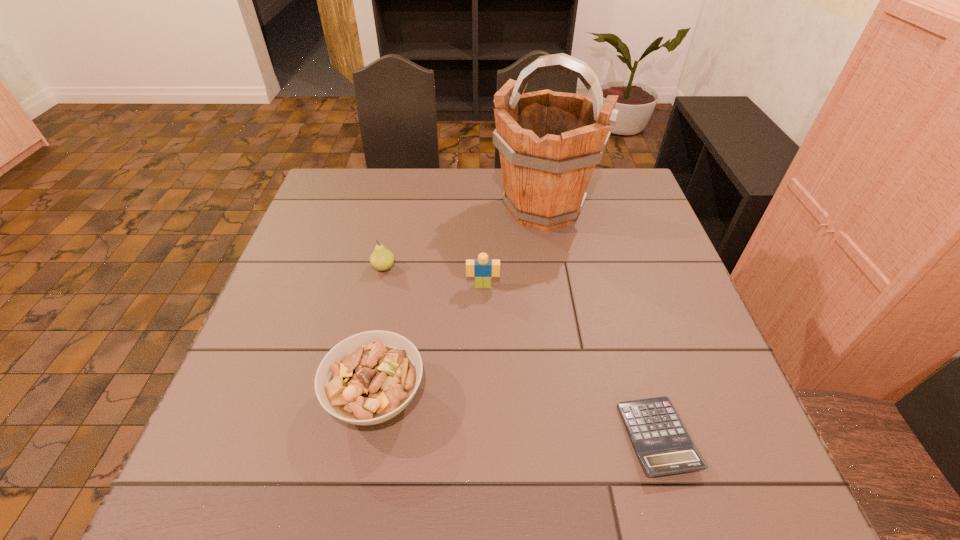
The width and height of the screenshot is (960, 540). Identify the location of bucket. (549, 142).

Image resolution: width=960 pixels, height=540 pixels. Identify the location of the tallest object. (549, 142).

Identify the location of Lego. (482, 268).

Find the location of `pear`. pear is located at coordinates (381, 259).

Identify the location of stew. (368, 378).

The height and width of the screenshot is (540, 960). I want to click on the shortest object, so click(x=663, y=445).

Where is `vacant space situated 0.110m on the left of the farthest object`? The width and height of the screenshot is (960, 540). vacant space situated 0.110m on the left of the farthest object is located at coordinates (454, 208).

Find the location of `blank area located 0.190m on the face of the Lego`. blank area located 0.190m on the face of the Lego is located at coordinates (483, 354).

This screenshot has width=960, height=540. What are the coordinates of `vacant space located 0.100m on the left of the pear` in the screenshot? It's located at point(333,267).

The image size is (960, 540). I want to click on blank area located on the right of the stew, so click(477, 397).